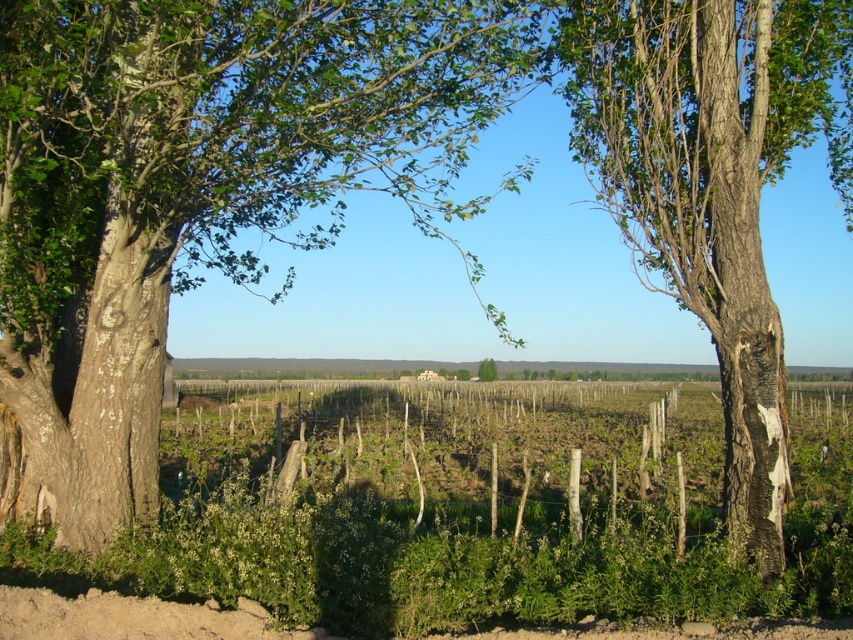
Who is shorter, green leafy vines at center or green leafy tree at center?

Standing shorter between the two is green leafy tree at center.

Can you confirm if green leafy vines at center is thinner than green leafy tree at center?

Incorrect, green leafy vines at center's width is not less than green leafy tree at center's.

Between point (334, 536) and point (482, 362), which one is positioned behind?

The point (482, 362) is behind.

Where is `green leafy vines at center`? This screenshot has height=640, width=853. green leafy vines at center is located at coordinates (466, 512).

Where is `smooth bark tree at right`? This screenshot has width=853, height=640. smooth bark tree at right is located at coordinates (711, 184).

Which of these two, smooth bark tree at right or green leafy tree at center, stands shorter?

With less height is green leafy tree at center.

Where is `smooth bark tree at right`? This screenshot has height=640, width=853. smooth bark tree at right is located at coordinates (711, 184).

Can you confirm if green leafy vines at center is shorter than smooth bark tree at right?

Correct, green leafy vines at center is not as tall as smooth bark tree at right.

Who is lower down, green leafy vines at center or smooth bark tree at right?

→ green leafy vines at center

Is point (842, 561) farther from camera compared to point (740, 387)?

No, it is in front of (740, 387).

Locate an element on the screen. This screenshot has width=853, height=640. green leafy vines at center is located at coordinates (466, 512).